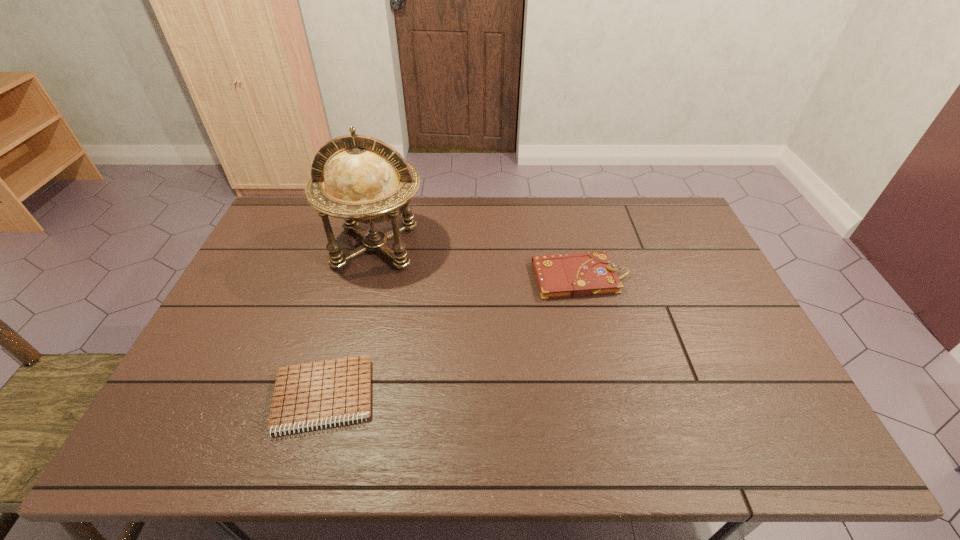
What are the coordinates of `vacant space at the far edge of the desktop` in the screenshot? It's located at (420, 220).

In the image, there is a desktop. At what (x,y) coordinates should I click in order to perform the action: click on vacant region at the near edge. Please return your answer as a coordinate pair (x, y). The image size is (960, 540). Looking at the image, I should click on (627, 427).

I want to click on free spot at the left edge of the desktop, so click(x=245, y=308).

Locate an element on the screen. The image size is (960, 540). vacant space at the right edge is located at coordinates (679, 282).

What are the coordinates of `vacant space at the far right corner of the desktop` in the screenshot? It's located at (671, 213).

The height and width of the screenshot is (540, 960). What are the coordinates of `vacant space at the near right corner of the desktop` in the screenshot? It's located at (811, 449).

This screenshot has height=540, width=960. In order to click on unoccupied area between the tallest object and the nearer notebook in this screenshot , I will do `click(349, 321)`.

Locate an element on the screen. blank region between the right notebook and the tallest object is located at coordinates (479, 261).

The width and height of the screenshot is (960, 540). I want to click on free area in between the tallest object and the shortest object, so click(349, 321).

Find the location of a particular element. The height and width of the screenshot is (540, 960). vacant area that lies between the nearer notebook and the taller notebook is located at coordinates (452, 337).